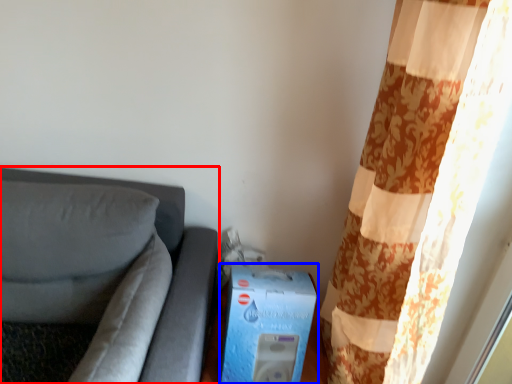
Question: Among these objects, which one is nearest to the camera, furniture (highlighted by a red box) or box (highlighted by a blue box)?

Choices:
 (A) furniture
 (B) box

Answer: (A)